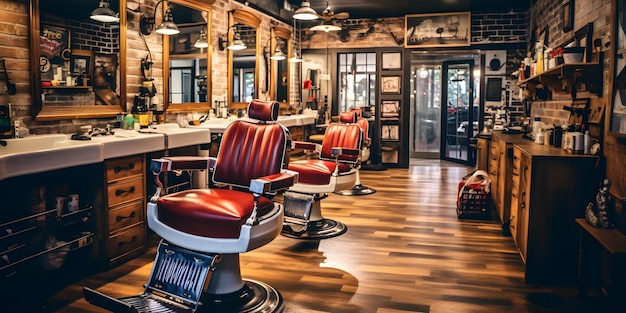
The image size is (626, 313). In order to click on light in this screenshot , I will do click(x=168, y=26), click(x=230, y=36), click(x=275, y=44), click(x=310, y=16), click(x=103, y=15).